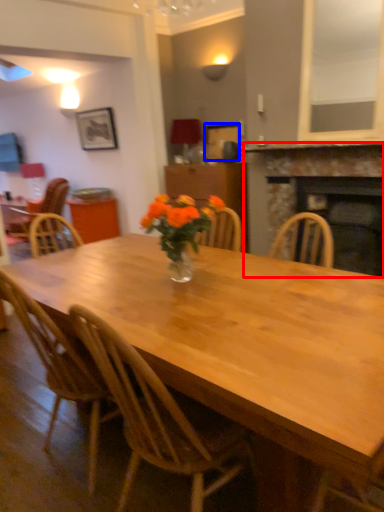
Question: Which of the following is the closest to the observer, fireplace (highlighted by a red box) or picture frame (highlighted by a blue box)?

Choices:
 (A) fireplace
 (B) picture frame

Answer: (A)